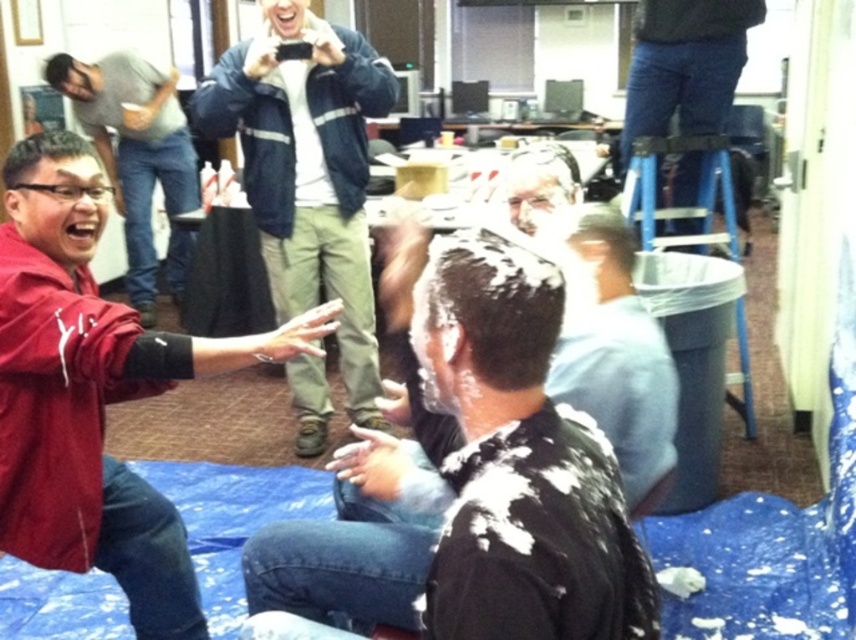
Is denim jacket at center wider than jeans at upper right?

→ Indeed, denim jacket at center has a greater width compared to jeans at upper right.

Is denim jacket at center thinner than jeans at upper right?

In fact, denim jacket at center might be wider than jeans at upper right.

Describe the element at coordinates (308, 170) in the screenshot. I see `denim jacket at center` at that location.

Locate an element on the screen. Image resolution: width=856 pixels, height=640 pixels. denim jacket at center is located at coordinates (x=308, y=170).

This screenshot has width=856, height=640. Describe the element at coordinates (94, 392) in the screenshot. I see `matte red jacket at center-left` at that location.

Does point (33, 458) lie behind point (179, 259)?

No.

Which is behind, point (278, 344) or point (143, 314)?

The point (143, 314) is behind.

The image size is (856, 640). What are the coordinates of `matte red jacket at center-left` in the screenshot? It's located at (94, 392).

Can you confirm if shiny black shirt at center is smaller than matte red jacket at left?

Correct, shiny black shirt at center occupies less space than matte red jacket at left.

This screenshot has height=640, width=856. What do you see at coordinates (474, 472) in the screenshot?
I see `shiny black shirt at center` at bounding box center [474, 472].

This screenshot has height=640, width=856. I want to click on shiny black shirt at center, so click(x=474, y=472).